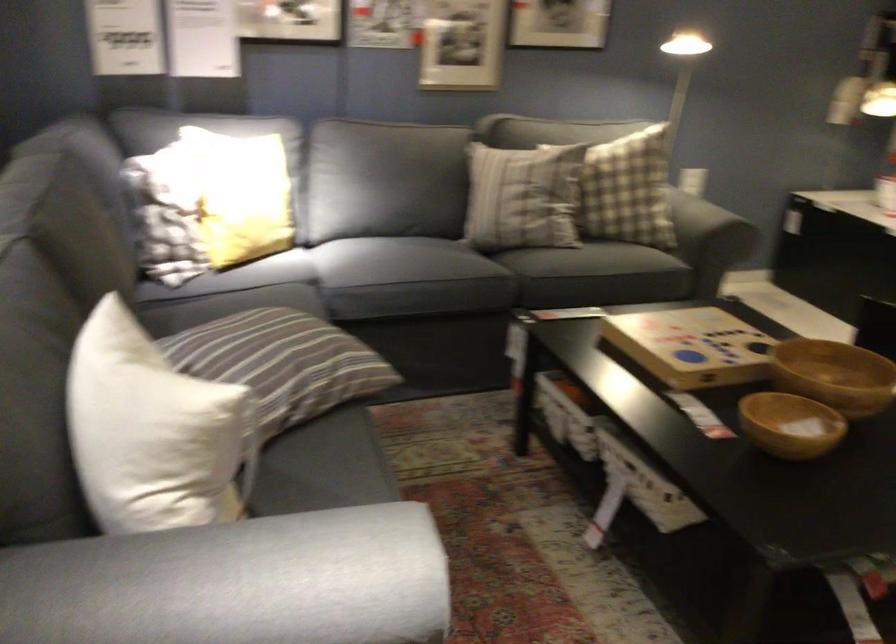
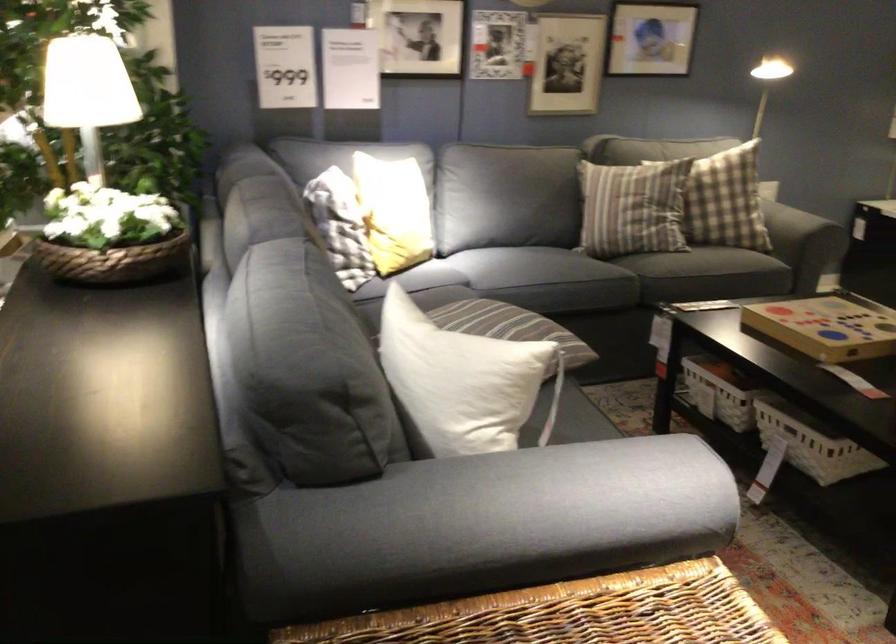
In the second image, find the point that corresponds to point 636,496 in the first image.

(814, 448)